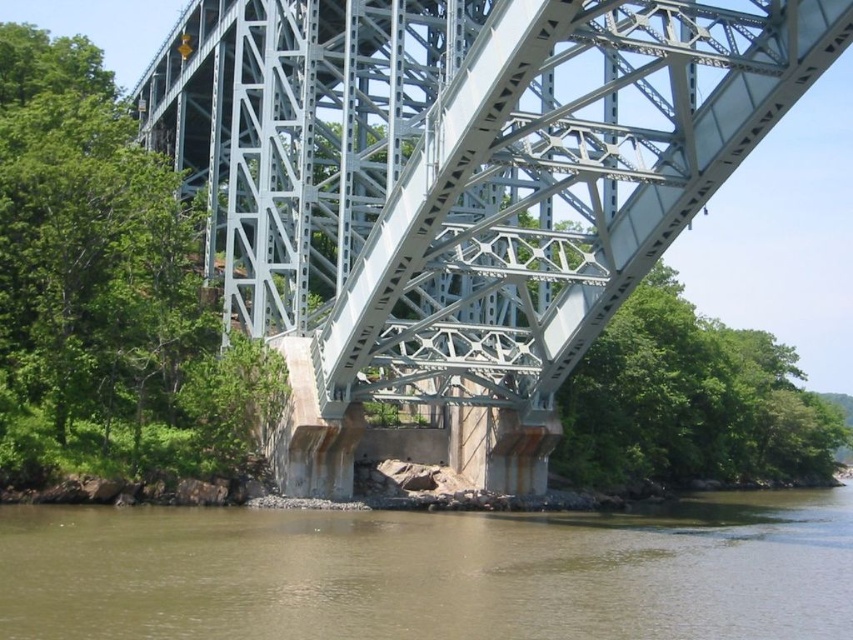
From the picture: You are a drone operator tasked with flying a drone under the metallic steel arch bridge at center. The drone has a maximum height clearance of 1 meter. Based on the scene, can the drone safely pass under the bridge without hitting the brown sedimentary rock at lower center?

The metallic steel arch bridge at center has a greater height compared to the brown sedimentary rock at lower center. Since the bridge is taller than the rock, the drone can safely pass under the bridge as long as it stays within the bridge structure and avoids the rock, which is lower and possibly located near the riverbank.

Based on the photo, you are a construction worker tasked with placing a 10 meter wide safety net beneath the bridge. Given the metallic steel arch bridge at center and the brown sedimentary rock at lower center, which object should you prioritize to ensure the safety net covers the widest part of the bridge?

The metallic steel arch bridge at center is wider than the brown sedimentary rock at lower center, so you should prioritize placing the safety net beneath the metallic steel arch bridge at center to cover its wider span.

You are standing on the riverbank and want to cross to the other side. The metallic steel arch bridge at center and the brown sedimentary rock at lower center are in your path. Which one is closer to you?

The metallic steel arch bridge at center is closer to you because it is positioned further to the viewer than the brown sedimentary rock at lower center, meaning it appears nearer in the visual perspective.